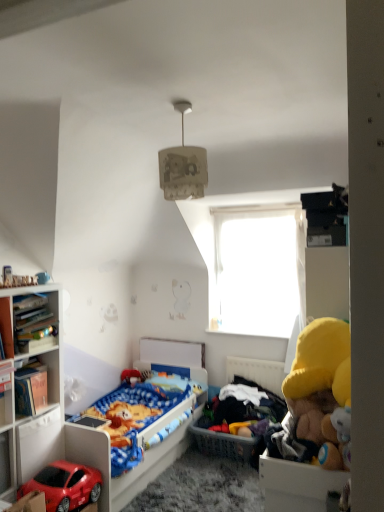
The image size is (384, 512). In order to click on free location above transparent plastic window at upper center (from a real-world perspective) in this screenshot , I will do `click(239, 208)`.